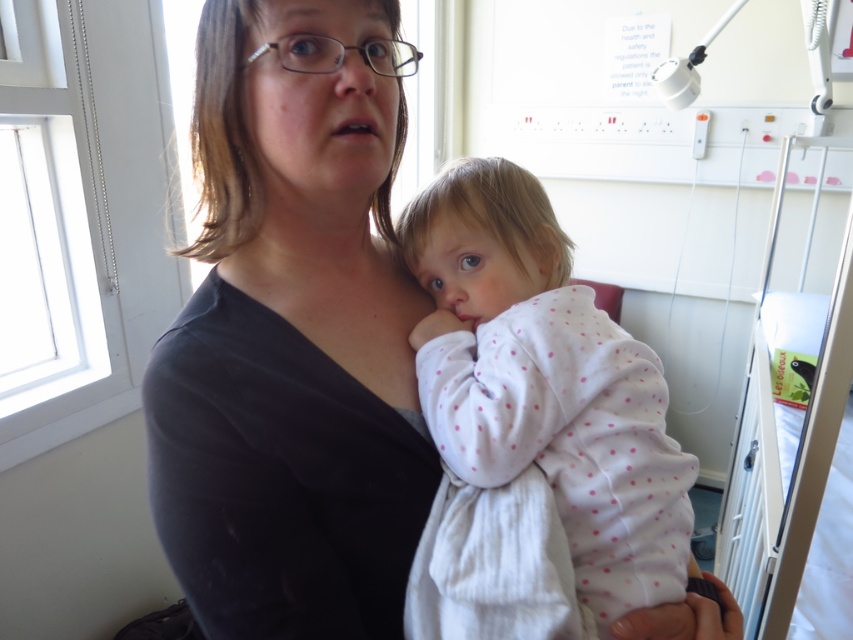
In the scene shown: You are a nurse in a hospital room. You need to locate the matte black shirt at center and the white polka dot fabric at center. Which one is positioned to the left?

The matte black shirt at center is to the left of the white polka dot fabric at center.

You are a photographer adjusting your camera focus. You need to focus on two specific points in the image, point (181, 332) and point (651, 529). Which point should you adjust your focus to first if you want to capture the nearest object first?

Point (181, 332) is closer to the camera than point (651, 529), so you should focus on point (181, 332) first to capture the nearest object.

You are a nurse in a hospital room. You need to place a medical chart on the table so that it is directly above the point marked at coordinates point (291, 340). Is the matte black shirt at center currently in the way of where you want to place the chart?

The matte black shirt at center is located at point (291, 340), so placing the medical chart directly above that point would require moving the matte black shirt at center first.